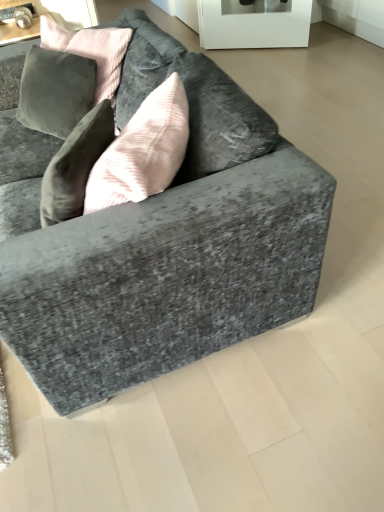
You are a GUI agent. You are given a task and a screenshot of the screen. Output one action in this format:
    pyautogui.click(x=<x>, y=<y>)
    Task: Click on the velvet gray couch at center
    
    Given the screenshot: What is the action you would take?
    pyautogui.click(x=160, y=240)

The width and height of the screenshot is (384, 512). What do you see at coordinates (160, 240) in the screenshot?
I see `velvet gray couch at center` at bounding box center [160, 240].

This screenshot has height=512, width=384. Find the location of `velvet gray couch at center`. velvet gray couch at center is located at coordinates (160, 240).